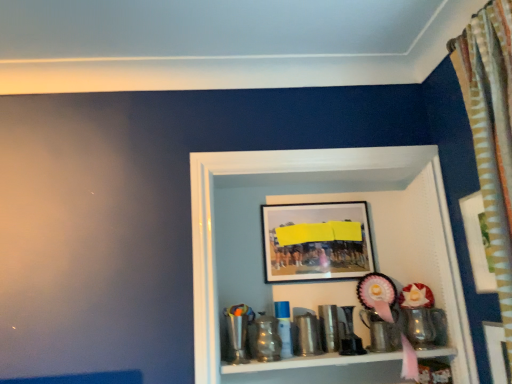
Question: Considering the relative sizes of metallic silver cup at lower right, the first toy when ordered from right to left, and wooden picture frame at upper right, marked as the 2th picture frame in a back-to-front arrangement, in the image provided, is metallic silver cup at lower right, the first toy when ordered from right to left, smaller than wooden picture frame at upper right, marked as the 2th picture frame in a back-to-front arrangement,?

Choices:
 (A) no
 (B) yes

Answer: (B)

Question: From the image's perspective, is metallic silver cup at lower right, the first toy when ordered from right to left, located beneath wooden picture frame at upper right, marked as the 2th picture frame in a left-to-right arrangement?

Choices:
 (A) no
 (B) yes

Answer: (B)

Question: From a real-world perspective, does metallic silver cup at lower right, the first toy when ordered from right to left, stand above wooden picture frame at upper right, marked as the 2th picture frame in a back-to-front arrangement?

Choices:
 (A) no
 (B) yes

Answer: (A)

Question: Is metallic silver cup at lower right, which is counted as the second toy, starting from the left, to the right of wooden picture frame at upper right, which is the 1th picture frame from front to back, from the viewer's perspective?

Choices:
 (A) yes
 (B) no

Answer: (B)

Question: Is the depth of metallic silver cup at lower right, the first toy when ordered from right to left, less than that of wooden picture frame at upper right, marked as the 2th picture frame in a back-to-front arrangement?

Choices:
 (A) no
 (B) yes

Answer: (A)

Question: Is matte black picture frame at upper center, the first picture frame viewed from the left, in front of or behind metallic shiny cup at lower center, the second toy viewed from the right, in the image?

Choices:
 (A) front
 (B) behind

Answer: (B)

Question: Looking at their shapes, would you say matte black picture frame at upper center, the first picture frame viewed from the left, is wider or thinner than metallic shiny cup at lower center, the second toy viewed from the right?

Choices:
 (A) wide
 (B) thin

Answer: (B)

Question: Considering the positions of matte black picture frame at upper center, the first picture frame viewed from the left, and metallic shiny cup at lower center, the second toy viewed from the right, in the image, is matte black picture frame at upper center, the first picture frame viewed from the left, bigger or smaller than metallic shiny cup at lower center, the second toy viewed from the right,?

Choices:
 (A) small
 (B) big

Answer: (B)

Question: Visually, is matte black picture frame at upper center, the first picture frame viewed from the left, positioned to the left or to the right of metallic shiny cup at lower center, which is the first toy in left-to-right order?

Choices:
 (A) left
 (B) right

Answer: (B)

Question: From a real-world perspective, is metallic trophy at center positioned above or below metallic silver cup at lower right, which is counted as the second toy, starting from the left?

Choices:
 (A) above
 (B) below

Answer: (A)

Question: Is metallic trophy at center bigger or smaller than metallic silver cup at lower right, which is counted as the second toy, starting from the left?

Choices:
 (A) big
 (B) small

Answer: (A)

Question: Is point (284, 372) positioned closer to the camera than point (414, 342)?

Choices:
 (A) closer
 (B) farther

Answer: (A)

Question: In terms of width, does metallic trophy at center look wider or thinner when compared to metallic silver cup at lower right, which is counted as the second toy, starting from the left?

Choices:
 (A) wide
 (B) thin

Answer: (A)

Question: Considering the positions of metallic shiny cup at lower center, the second toy viewed from the right, and metallic silver cup at lower right, the first toy when ordered from right to left, in the image, is metallic shiny cup at lower center, the second toy viewed from the right, taller or shorter than metallic silver cup at lower right, the first toy when ordered from right to left,?

Choices:
 (A) tall
 (B) short

Answer: (A)

Question: Visually, is metallic shiny cup at lower center, the second toy viewed from the right, positioned to the left or to the right of metallic silver cup at lower right, the first toy when ordered from right to left?

Choices:
 (A) right
 (B) left

Answer: (B)